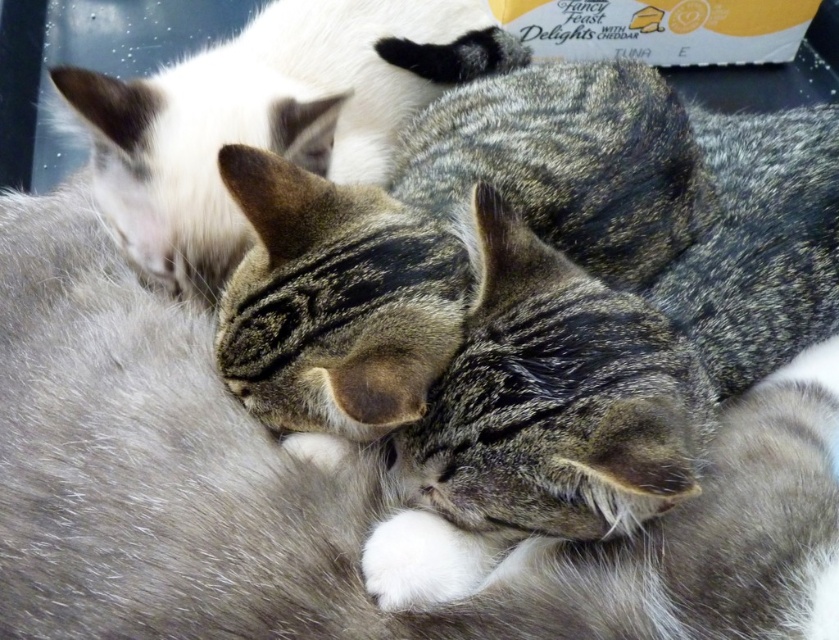
You are a veterinarian examining two cats in an image. The cats are labeled as the tabby fur cat at center and the tabby fur cat at upper left. Based on their sizes, which cat would require a larger examination table to accommodate its size?

The tabby fur cat at center is larger in size than the tabby fur cat at upper left, so it would require a larger examination table to accommodate its size.

You are a photographer trying to capture a close up of the tabby fur cat at center. You notice a point at coordinates point (444, 225). Is this point located on the tabby fur cat at center?

Yes, the point (444, 225) is on the tabby fur cat at center according to the description.